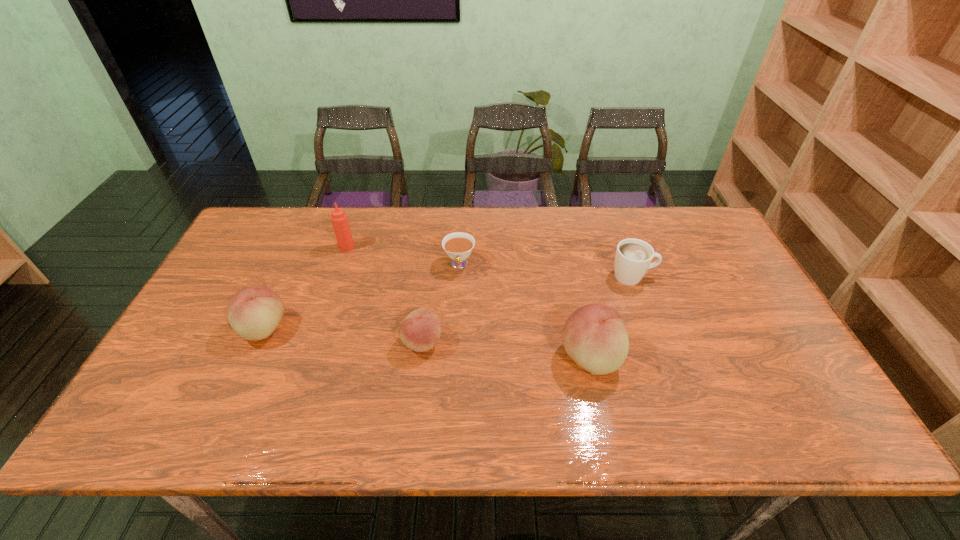
Find the location of a particular element. free space between the cappuccino and the second peach from right to left is located at coordinates (527, 309).

You are a GUI agent. You are given a task and a screenshot of the screen. Output one action in this format:
    pyautogui.click(x=<x>, y=<y>)
    Task: Click on the empty location between the tallest peach and the teacup
    
    Given the screenshot: What is the action you would take?
    pyautogui.click(x=524, y=311)

Point out which object is positioned as the fifth nearest to the shortest object. Please provide its 2D coordinates. Your answer should be formatted as a tuple, i.e. [(x, y)], where the tuple contains the x and y coordinates of a point satisfying the conditions above.

[(254, 313)]

Identify which object is the nearest to the second tallest peach. Please provide its 2D coordinates. Your answer should be formatted as a tuple, i.e. [(x, y)], where the tuple contains the x and y coordinates of a point satisfying the conditions above.

[(339, 218)]

Where is `peach that can be found as the second closest to the rightmost peach`? This screenshot has width=960, height=540. peach that can be found as the second closest to the rightmost peach is located at coordinates (254, 313).

The image size is (960, 540). I want to click on peach that is the second closest one to the shortest object, so click(594, 336).

Locate an element on the screen. This screenshot has width=960, height=540. vacant space that satisfies the following two spatial constraints: 1. on the side of the teacup with the handle; 2. on the left side of the fifth object from left to right is located at coordinates (455, 357).